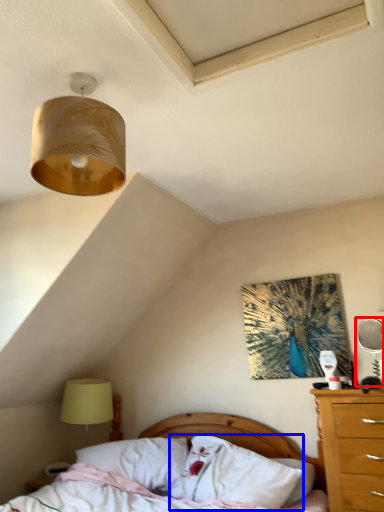
Question: Which object appears closest to the camera in this image, mechanical fan (highlighted by a red box) or pillow (highlighted by a blue box)?

Choices:
 (A) mechanical fan
 (B) pillow

Answer: (B)